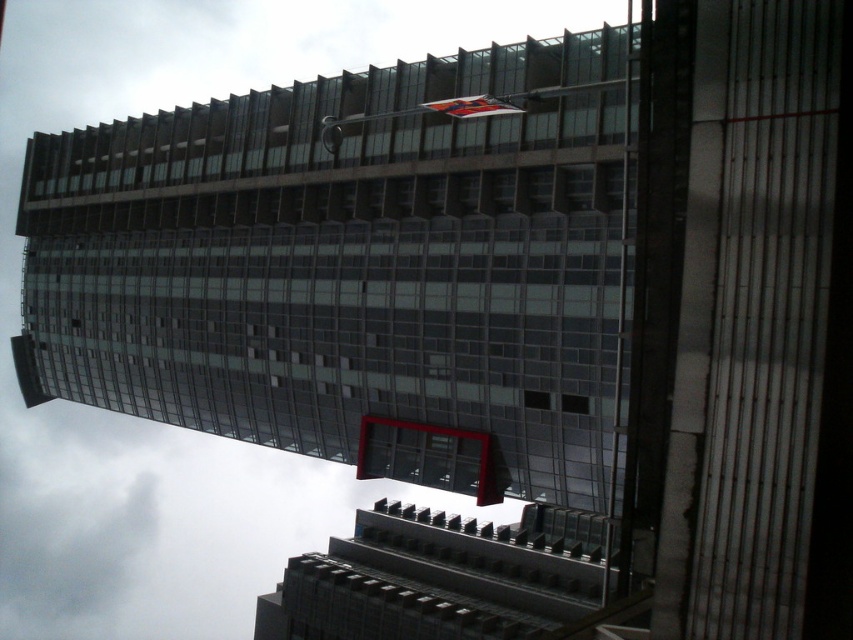
You are standing at a point 55 meters away from the building. You want to take a photo of the red rectangular element in the building. Is the point at [367,88] on the building within your camera frame? Assume your camera has a standard field of view of 60 degrees.

The point at [367,88] is 55.02 meters away from the viewer. To determine if it fits in a 60 degree field of view, we need to calculate the angular size. However, without knowing the building dimensions or the exact position of the point relative to the camera, we can only confirm the distance. The question cannot be definitively answered with the given information.

You are an architect reviewing the building design. You notice two elements in the image. Which one is positioned to the left of the other? The glassy steel tower at center and the red fabric flag at upper center. Please specify which is on the left.

The glassy steel tower at center is positioned to the left of the red fabric flag at upper center.